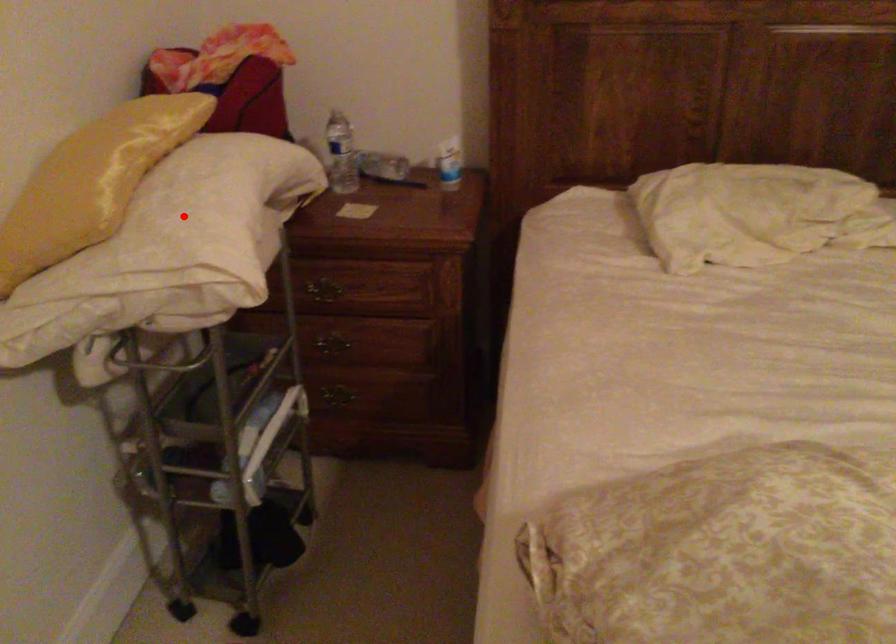
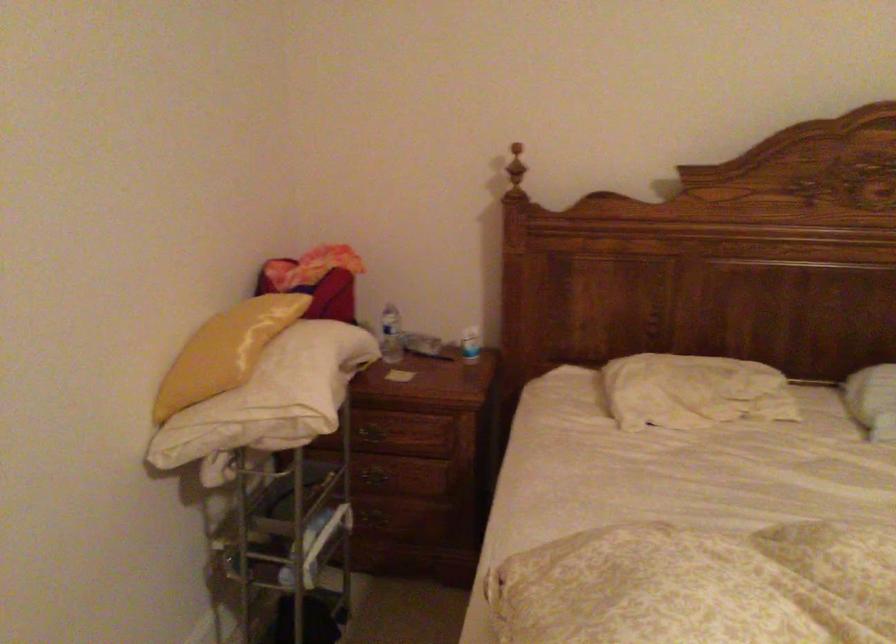
Question: I am providing you with two images of the same scene from different viewpoints. A red point is shown in image1. For the corresponding object point in image2, is it positioned nearer or farther from the camera?

Choices:
 (A) Nearer
 (B) Farther

Answer: (B)